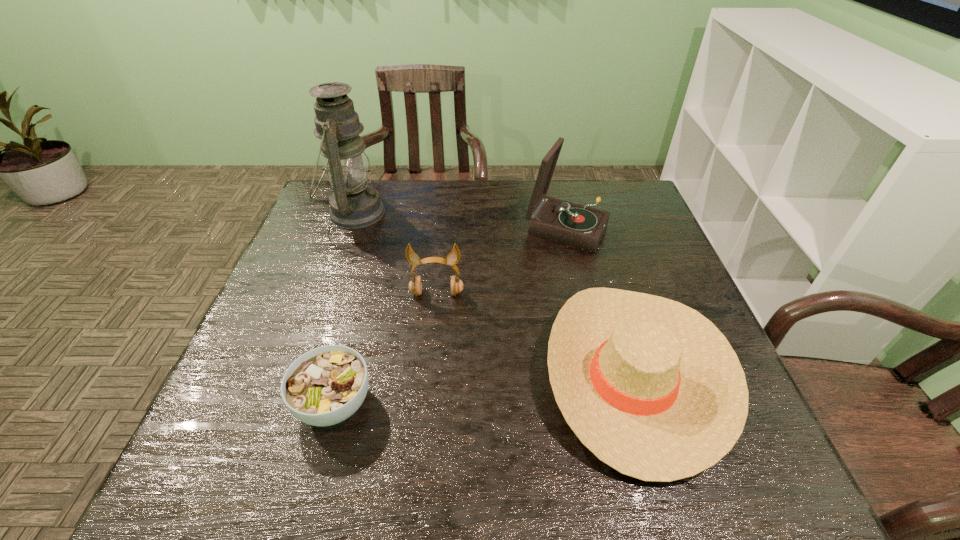
The height and width of the screenshot is (540, 960). I want to click on oil lamp, so click(353, 204).

Locate an element on the screen. phonograph record is located at coordinates (557, 220).

Where is `the third object from left to right`? This screenshot has height=540, width=960. the third object from left to right is located at coordinates (415, 285).

This screenshot has width=960, height=540. Find the location of `the third shortest object`. the third shortest object is located at coordinates (415, 285).

You are a GUI agent. You are given a task and a screenshot of the screen. Output one action in this format:
    pyautogui.click(x=<x>, y=<y>)
    Task: Click on the second shortest object
    The image size is (960, 540).
    Given the screenshot: What is the action you would take?
    pyautogui.click(x=650, y=386)

This screenshot has height=540, width=960. What are the coordinates of `the shortest object` in the screenshot? It's located at (326, 385).

Where is `vacant space located 0.340m on the front of the tallest object`? The width and height of the screenshot is (960, 540). vacant space located 0.340m on the front of the tallest object is located at coordinates (312, 330).

At what (x,y) coordinates should I click in order to perform the action: click on vacant area situated 0.240m on the front of the phonograph record. Please return your answer as a coordinate pair (x, y). This screenshot has width=960, height=540. Looking at the image, I should click on (587, 318).

Find the location of a particular element. The height and width of the screenshot is (540, 960). vacant space located 0.240m on the front-facing side of the earphone is located at coordinates (427, 386).

What are the coordinates of `free region located on the back of the second shortest object` in the screenshot? It's located at (584, 206).